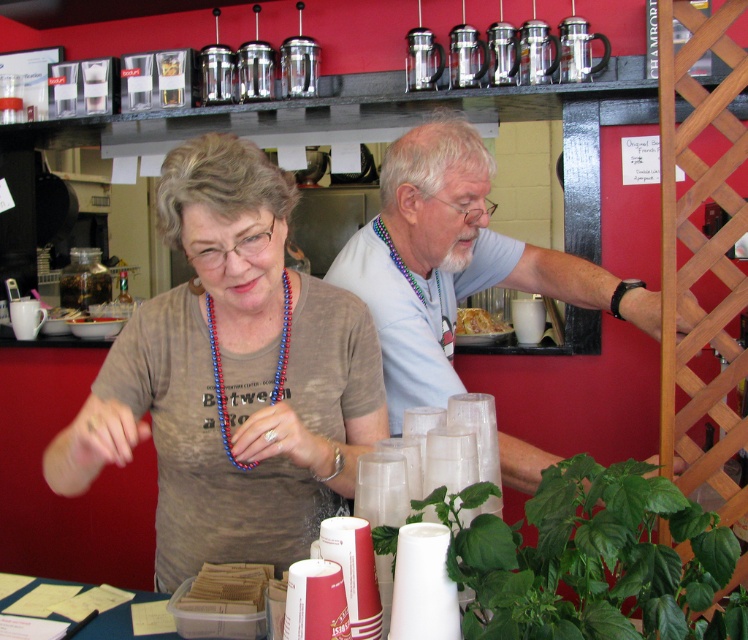
You are a customer in the cafe and want to place a napkin on the table between the brown cotton shirt at center and the golden crispy pastry at center. Which object should you place the napkin closer to if you want it to be higher?

The brown cotton shirt at center is taller than the golden crispy pastry at center, so placing the napkin closer to the brown cotton shirt at center will result in a higher placement.